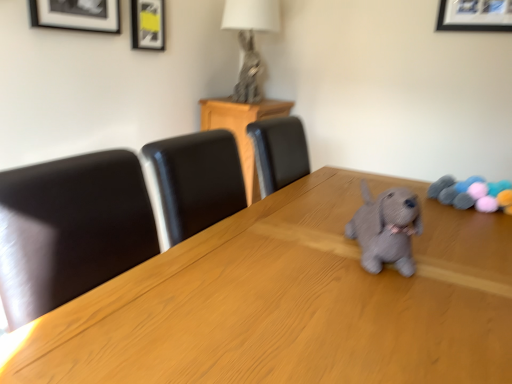
Question: From a real-world perspective, is gray knitted stuffed animal at right located beneath black leather chair at center?

Choices:
 (A) no
 (B) yes

Answer: (A)

Question: Is gray knitted stuffed animal at right closer to the viewer compared to black leather chair at center?

Choices:
 (A) no
 (B) yes

Answer: (B)

Question: Considering the relative sizes of gray knitted stuffed animal at right and black leather chair at center in the image provided, is gray knitted stuffed animal at right wider than black leather chair at center?

Choices:
 (A) yes
 (B) no

Answer: (A)

Question: Is gray knitted stuffed animal at right to the right of black leather chair at center from the viewer's perspective?

Choices:
 (A) no
 (B) yes

Answer: (B)

Question: Is gray knitted stuffed animal at right completely or partially outside of black leather chair at center?

Choices:
 (A) no
 (B) yes

Answer: (B)

Question: Is gray knitted stuffed animal at right to the left of black leather chair at center from the viewer's perspective?

Choices:
 (A) no
 (B) yes

Answer: (A)

Question: Is the position of matte black picture frame at upper left, acting as the 1th picture frame starting from the back, more distant than that of matte black picture frame at upper left, the second picture frame from the right?

Choices:
 (A) yes
 (B) no

Answer: (A)

Question: From a real-world perspective, is matte black picture frame at upper left, which is counted as the 1th picture frame, starting from the right, located higher than matte black picture frame at upper left, the 2th picture frame viewed from the back?

Choices:
 (A) no
 (B) yes

Answer: (A)

Question: Can you confirm if matte black picture frame at upper left, which is counted as the 1th picture frame, starting from the right, is shorter than matte black picture frame at upper left, the 2th picture frame viewed from the back?

Choices:
 (A) no
 (B) yes

Answer: (B)

Question: From a real-world perspective, is matte black picture frame at upper left, which is counted as the 1th picture frame, starting from the right, below matte black picture frame at upper left, the second picture frame from the right?

Choices:
 (A) no
 (B) yes

Answer: (B)

Question: Could you tell me if matte black picture frame at upper left, acting as the 1th picture frame starting from the back, is turned towards matte black picture frame at upper left, the 2th picture frame viewed from the back?

Choices:
 (A) no
 (B) yes

Answer: (A)

Question: Does matte black picture frame at upper left, arranged as the second picture frame when viewed from the left, have a smaller size compared to matte black picture frame at upper left, which is the first picture frame in front-to-back order?

Choices:
 (A) yes
 (B) no

Answer: (A)

Question: From a real-world perspective, is gray knitted stuffed animal at right beneath metallic silver rabbit at upper center?

Choices:
 (A) yes
 (B) no

Answer: (A)